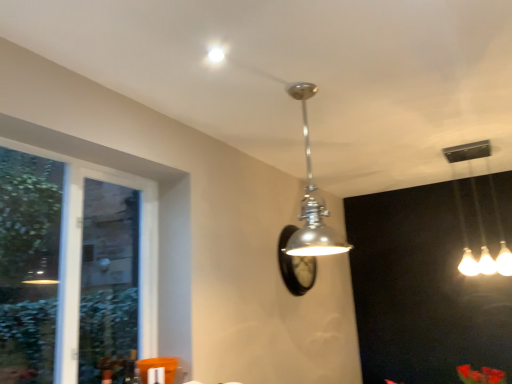
Question: Is polished chrome pendant light at center, the first lamp in the front-to-back sequence, oriented towards clear glass window at left?

Choices:
 (A) yes
 (B) no

Answer: (B)

Question: Considering the relative sizes of polished chrome pendant light at center, the first lamp in the front-to-back sequence, and clear glass window at left in the image provided, is polished chrome pendant light at center, the first lamp in the front-to-back sequence, thinner than clear glass window at left?

Choices:
 (A) yes
 (B) no

Answer: (B)

Question: Does polished chrome pendant light at center, which is counted as the first lamp, starting from the left, touch clear glass window at left?

Choices:
 (A) yes
 (B) no

Answer: (B)

Question: Does polished chrome pendant light at center, which is the 2th lamp in right-to-left order, appear on the right side of clear glass window at left?

Choices:
 (A) yes
 (B) no

Answer: (A)

Question: From a real-world perspective, is polished chrome pendant light at center, positioned as the second lamp in back-to-front order, located higher than clear glass window at left?

Choices:
 (A) yes
 (B) no

Answer: (A)

Question: Relative to matte silver droplight at upper center, is white glossy light fixture at upper right, which appears as the 2th lamp when viewed from the front, in front or behind?

Choices:
 (A) front
 (B) behind

Answer: (B)

Question: Is white glossy light fixture at upper right, the 2th lamp when ordered from left to right, bigger or smaller than matte silver droplight at upper center?

Choices:
 (A) big
 (B) small

Answer: (A)

Question: In terms of width, does white glossy light fixture at upper right, placed as the 1th lamp when sorted from back to front, look wider or thinner when compared to matte silver droplight at upper center?

Choices:
 (A) wide
 (B) thin

Answer: (A)

Question: Is point (498, 215) closer or farther from the camera than point (211, 56)?

Choices:
 (A) farther
 (B) closer

Answer: (A)

Question: Would you say white glossy light fixture at upper right, which ranks as the first lamp in right-to-left order, is to the left or to the right of polished chrome pendant light at center, which is counted as the first lamp, starting from the left, in the picture?

Choices:
 (A) right
 (B) left

Answer: (A)

Question: Does point (473, 273) appear closer or farther from the camera than point (309, 185)?

Choices:
 (A) farther
 (B) closer

Answer: (A)

Question: From the image's perspective, is white glossy light fixture at upper right, which ranks as the first lamp in right-to-left order, positioned above or below polished chrome pendant light at center, which is counted as the first lamp, starting from the left?

Choices:
 (A) below
 (B) above

Answer: (A)

Question: In the image, is white glossy light fixture at upper right, the 2th lamp when ordered from left to right, positioned in front of or behind polished chrome pendant light at center, positioned as the second lamp in back-to-front order?

Choices:
 (A) front
 (B) behind

Answer: (B)

Question: From a real-world perspective, relative to clear glass window at left, is polished chrome pendant light at center, which is the 2th lamp in right-to-left order, vertically above or below?

Choices:
 (A) above
 (B) below

Answer: (A)

Question: Is point (314, 236) positioned closer to the camera than point (76, 140)?

Choices:
 (A) farther
 (B) closer

Answer: (A)